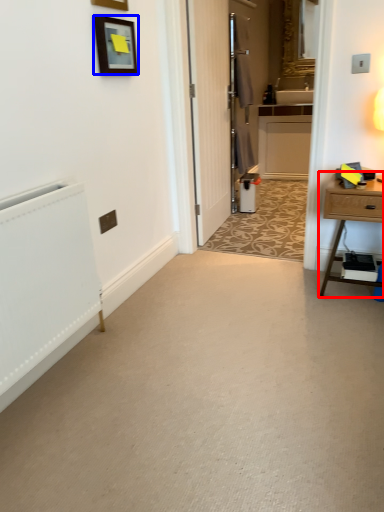
Question: Which point is further to the camera, nightstand (highlighted by a red box) or picture frame (highlighted by a blue box)?

Choices:
 (A) nightstand
 (B) picture frame

Answer: (A)